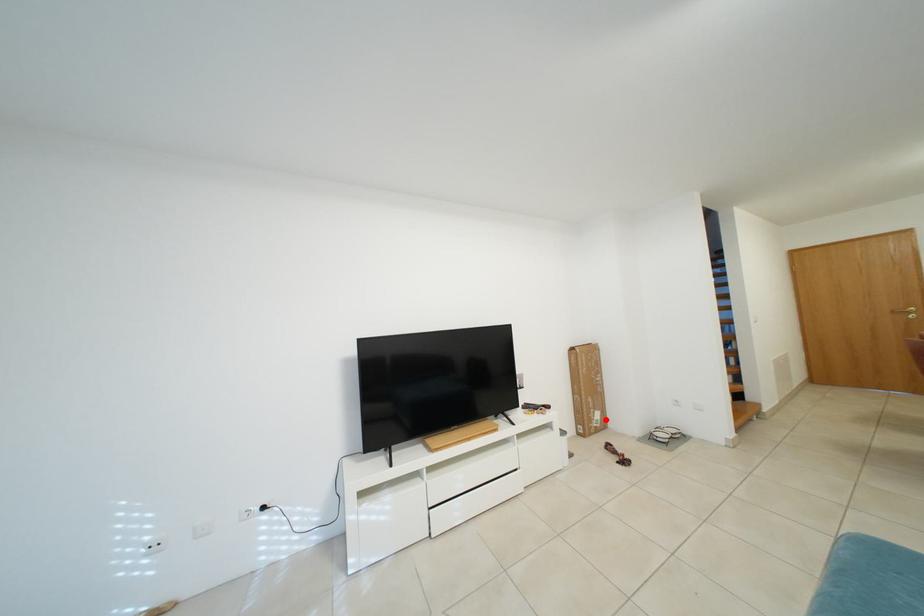
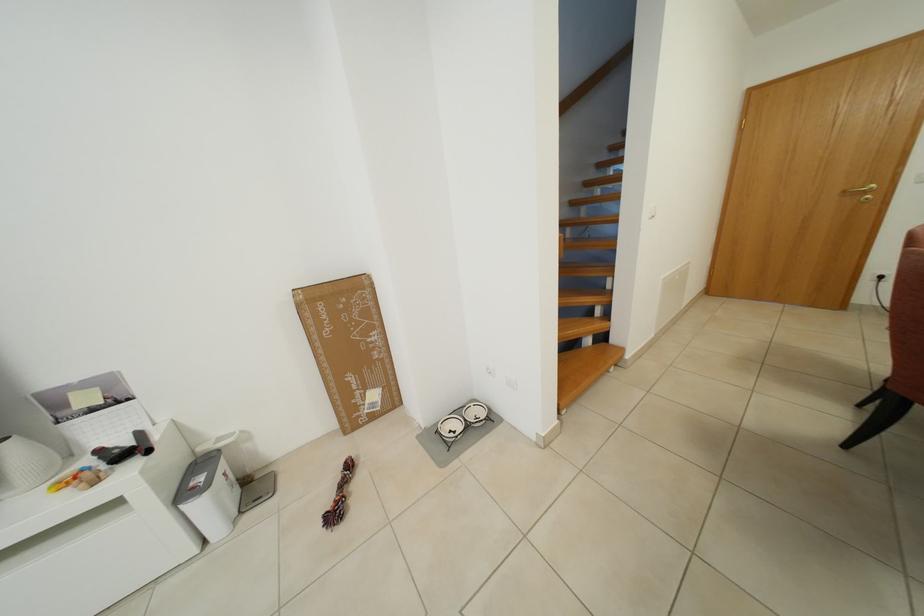
Question: I am providing you with two images of the same scene from different viewpoints. A red point is shown in image1. For the corresponding object point in image2, is it positioned nearer or farther from the camera?

Choices:
 (A) Nearer
 (B) Farther

Answer: (A)